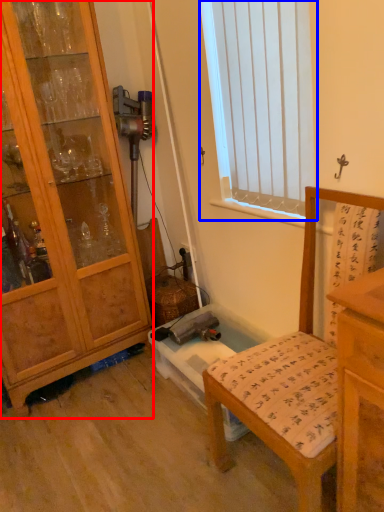
Question: Which of the following is the closest to the observer, cabinetry (highlighted by a red box) or window (highlighted by a blue box)?

Choices:
 (A) cabinetry
 (B) window

Answer: (B)